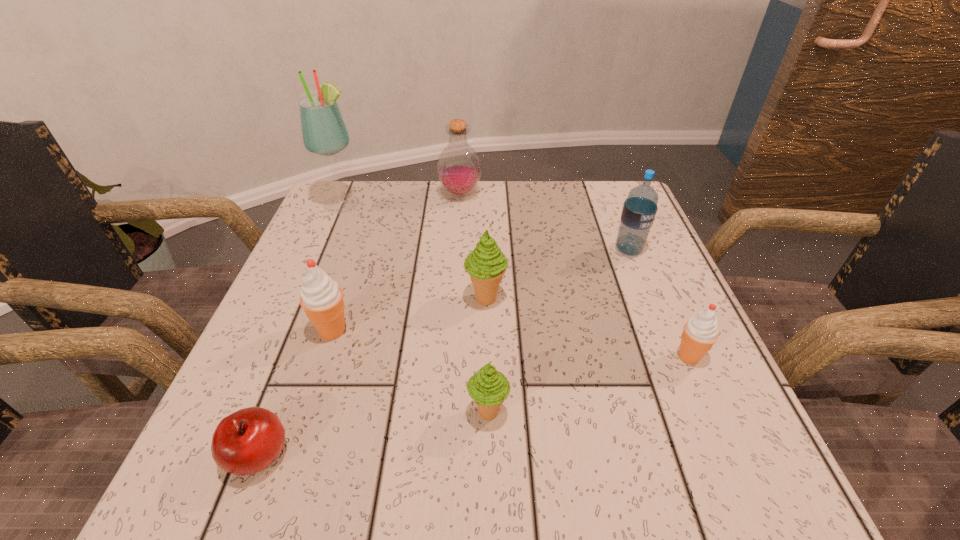
This screenshot has height=540, width=960. In order to click on the nearest icecream in this screenshot , I will do `click(488, 387)`.

Image resolution: width=960 pixels, height=540 pixels. Identify the location of the nearer green icecream. (488, 387).

I want to click on apple, so click(245, 442).

Find the location of a particular element. the shortest object is located at coordinates (245, 442).

At what (x,y) coordinates should I click in order to perform the action: click on blank space located 0.170m on the front of the alcohol. Please return your answer as a coordinate pair (x, y). Looking at the image, I should click on [x=320, y=262].

You are a GUI agent. You are given a task and a screenshot of the screen. Output one action in this format:
    pyautogui.click(x=<x>, y=<y>)
    Task: Click on the free space located 0.090m on the right of the bottle
    
    Given the screenshot: What is the action you would take?
    pyautogui.click(x=516, y=194)

Where is `vacant space situated 0.060m on the left of the sixth nearest object`? Image resolution: width=960 pixels, height=540 pixels. vacant space situated 0.060m on the left of the sixth nearest object is located at coordinates (587, 250).

Identify the location of vacant space located 0.080m on the front of the bigger red icecream. This screenshot has width=960, height=540. (315, 384).

Locate an element on the screen. The height and width of the screenshot is (540, 960). vacant point located on the left of the farthest icecream is located at coordinates pos(322,299).

Find the location of a particular element. vacant space located 0.130m on the left of the rightmost icecream is located at coordinates (598, 356).